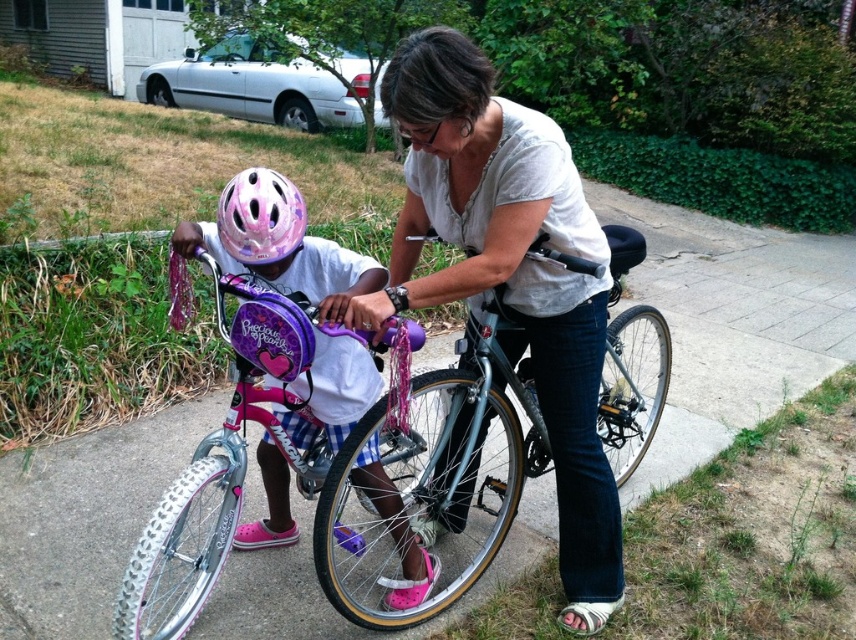
You are a photographer standing at the edge of the paved path. You want to take a photo of the pink matte bicycle at center and the pink glossy helmet at left. Which object will appear larger in your photo?

The pink matte bicycle at center will appear larger in the photo because it is closer to the viewer than the pink glossy helmet at left.

You are standing on a paved path and see the pink matte bicycle at center. If you want to touch it, how many steps do you need to take forward? Assume each step covers 0.75 meters.

The pink matte bicycle at center is 1.64 meters away. Since each step covers 0.75 meters, you would need to take 2 steps forward to reach it. After 1 step, you cover 0.75 meters, leaving 0.89 meters. A second step would bring you within 0.14 meters, which is close enough to touch it.

You are a delivery person who needs to park your bike between the pink matte bicycle at center and the pink glossy helmet at left. Is this possible?

The pink matte bicycle at center is to the left of the pink glossy helmet at left, so there is no space between them for parking. Choose another spot.